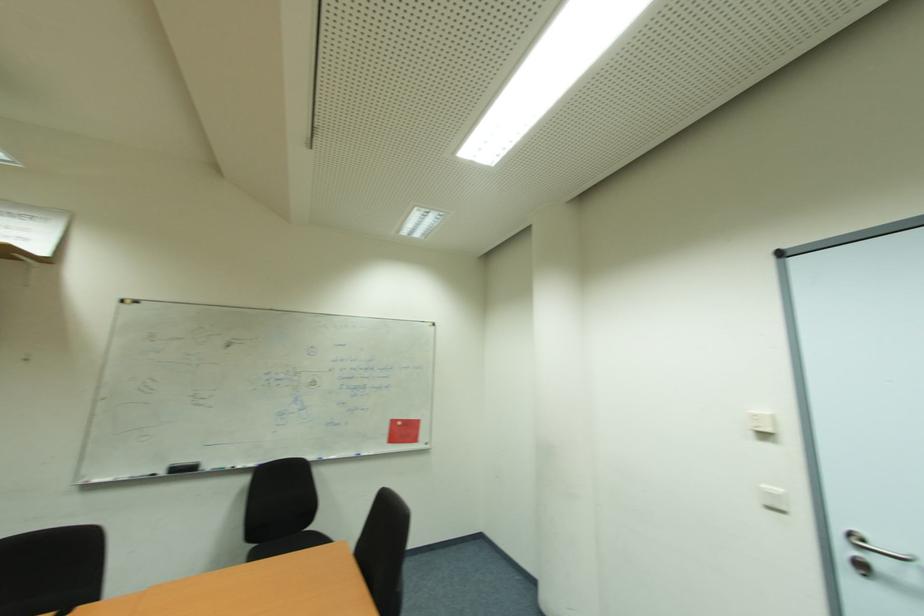
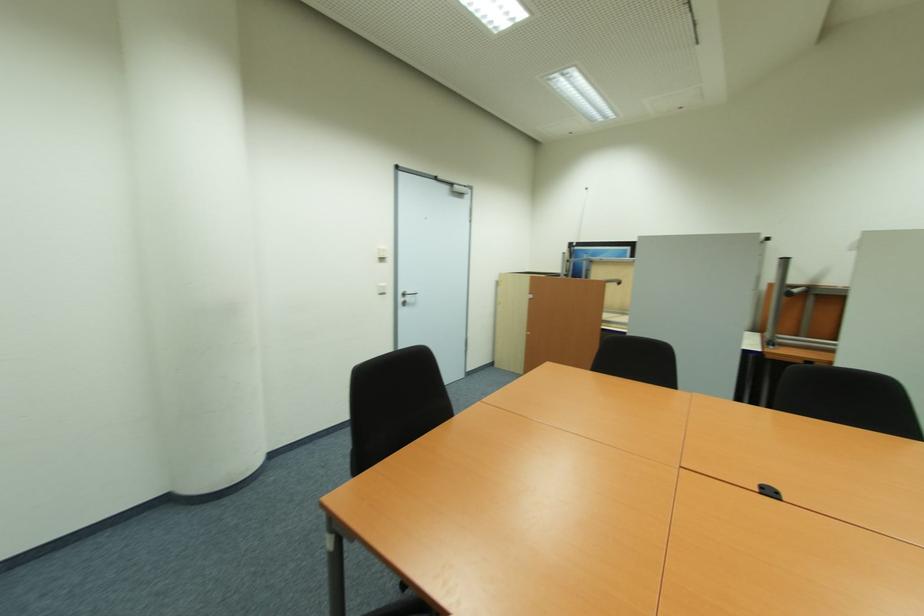
The point at (850,552) is marked in the first image. Where is the corresponding point in the second image?

(405, 300)